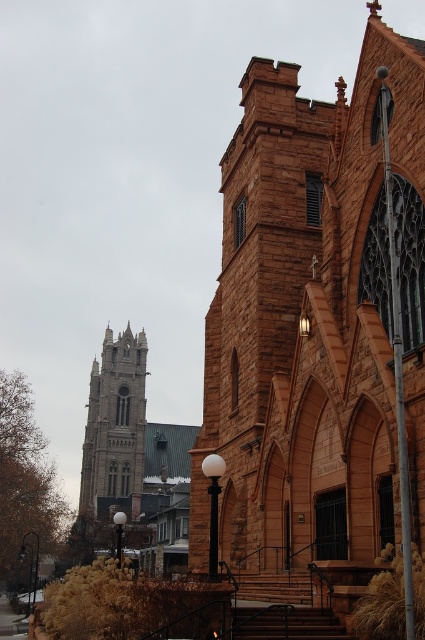
From the picture: Is brown stone church at center below stone gothic tower at upper left?

No.

Is point (388, 276) positioned behind point (90, 397)?

That is False.

The image size is (425, 640). Identify the location of brown stone church at center. (319, 321).